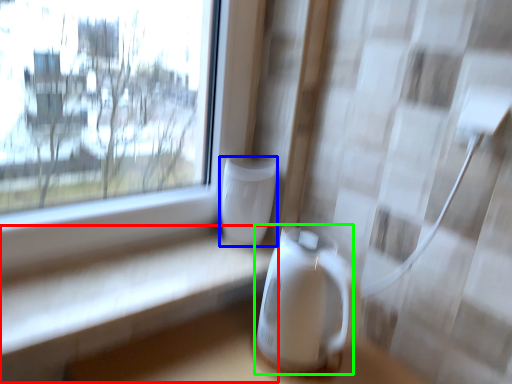
Question: Which object is positioned farthest from table (highlighted by a red box)? Select from appliance (highlighted by a blue box) and appliance (highlighted by a green box).

Choices:
 (A) appliance
 (B) appliance

Answer: (A)